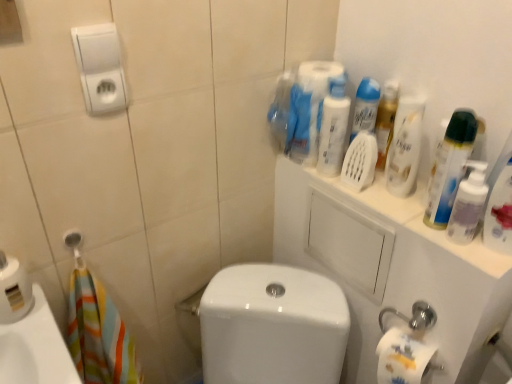
The image size is (512, 384). I want to click on vacant space positioned to the left of translucent plastic spray bottle at upper right, the 1th cleaning product positioned from the right, so click(x=426, y=234).